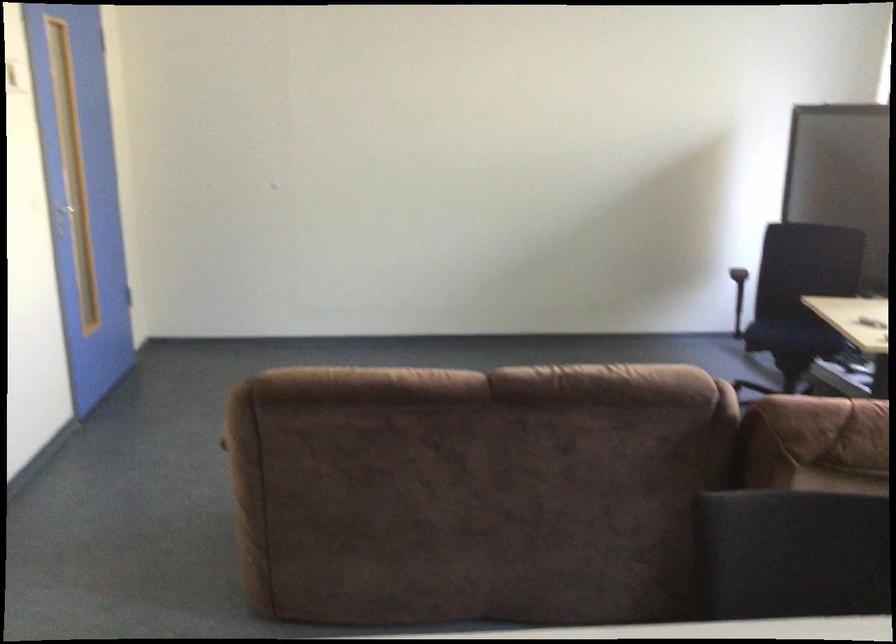
Describe the element at coordinates (793, 337) in the screenshot. I see `the chair sitting surface` at that location.